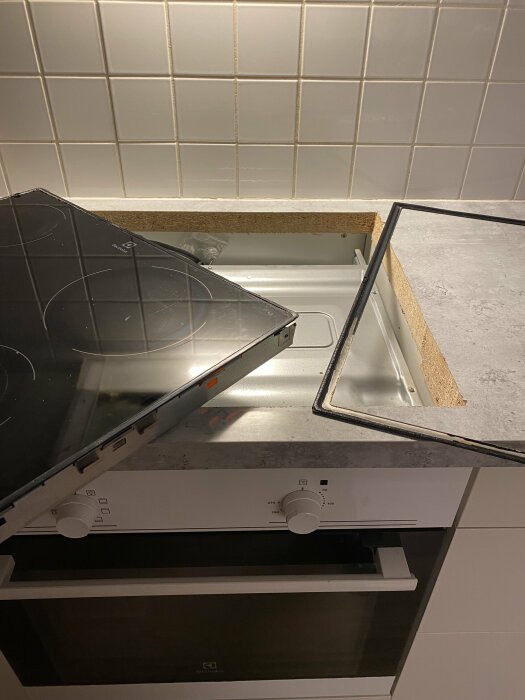
You are a GUI agent. You are given a task and a screenshot of the screen. Output one action in this format:
    pyautogui.click(x=<x>, y=<y>)
    Task: Click on the stove top
    Image resolution: width=525 pixels, height=700 pixels.
    Given the screenshot: What is the action you would take?
    pyautogui.click(x=103, y=390)